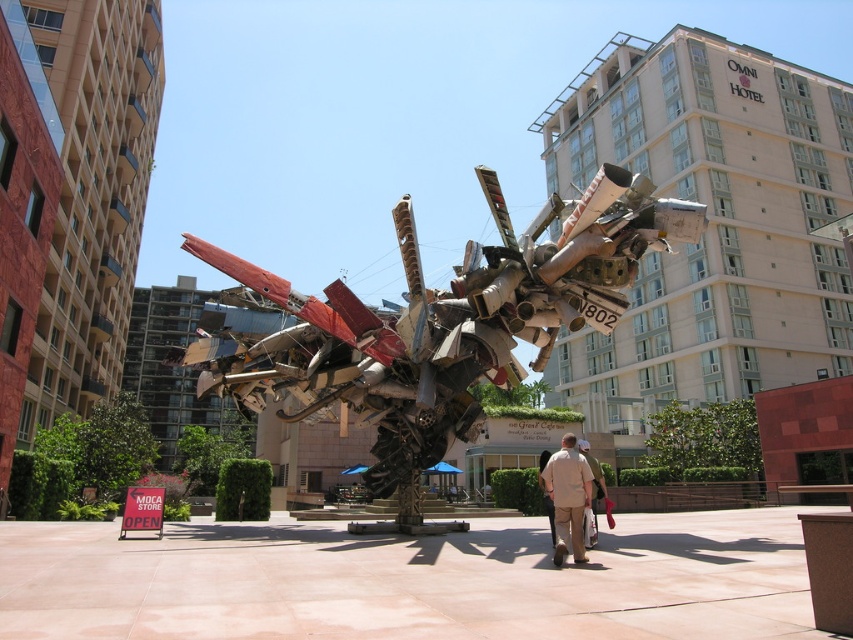
You are an artist planning to paint a figure wearing the tan fabric shirt at center and beige fabric pants at center. Which clothing item will appear narrower in your painting?

The tan fabric shirt at center will appear narrower in the painting since it has a lesser width compared to the beige fabric pants at center.